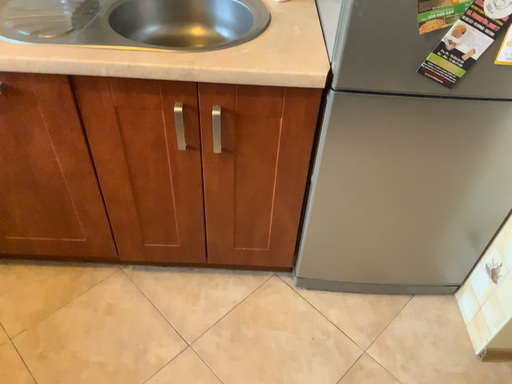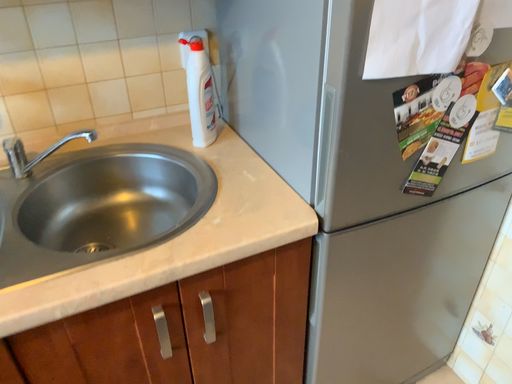
Question: Which way did the camera rotate in the video?

Choices:
 (A) rotated right
 (B) rotated left

Answer: (A)